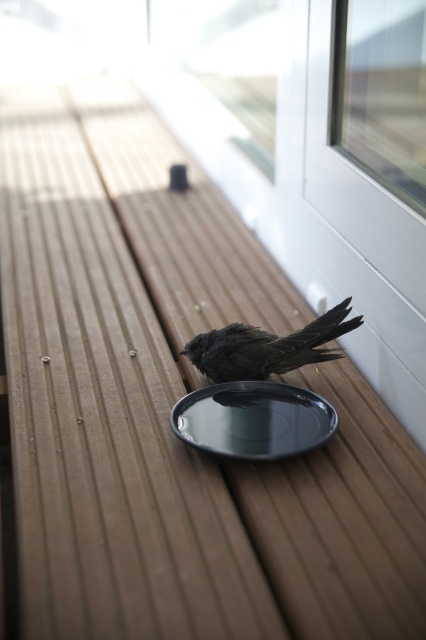
What do you see at coordinates (347, 220) in the screenshot? I see `transparent plastic screen door at upper right` at bounding box center [347, 220].

Is transparent plastic screen door at upper right thinner than shiny black plate at center?

Indeed, transparent plastic screen door at upper right has a lesser width compared to shiny black plate at center.

Locate an element on the screen. transparent plastic screen door at upper right is located at coordinates (347, 220).

Does shiny black plate at center appear under dark matte bird at center?

Correct, shiny black plate at center is located below dark matte bird at center.

Where is `shiny black plate at center`? shiny black plate at center is located at coordinates (253, 419).

Does transparent plastic screen door at upper right appear on the right side of dark matte bird at center?

Yes, transparent plastic screen door at upper right is to the right of dark matte bird at center.

Can you confirm if transparent plastic screen door at upper right is smaller than dark matte bird at center?

No.

The image size is (426, 640). Find the location of `transparent plastic screen door at upper right`. transparent plastic screen door at upper right is located at coordinates click(347, 220).

Identify the location of transparent plastic screen door at upper right. (347, 220).